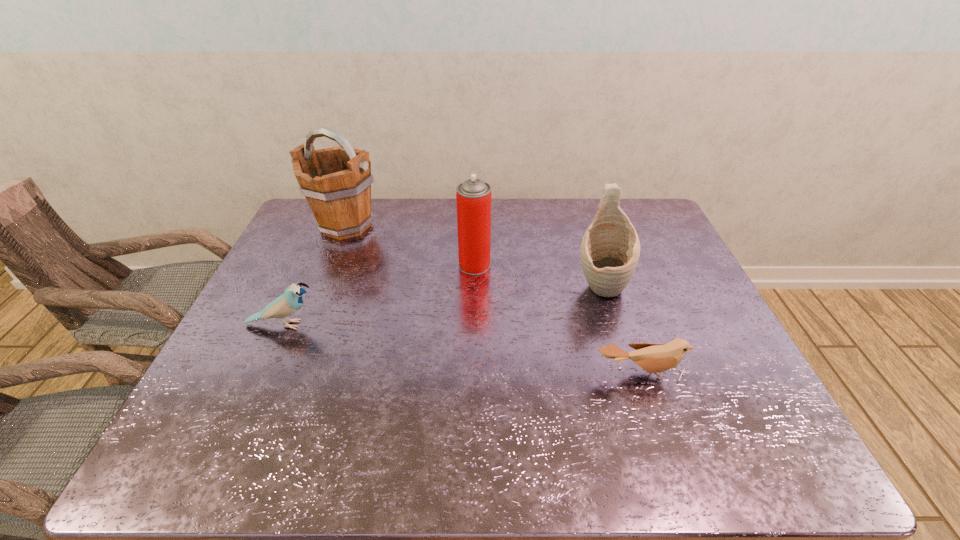
Where is `blank area located at the face of the taller bird`? blank area located at the face of the taller bird is located at coordinates (344, 325).

Where is `free point located at the beak of the nearest object`? free point located at the beak of the nearest object is located at coordinates (666, 451).

The height and width of the screenshot is (540, 960). What are the coordinates of `object located in the far edge section of the desktop` in the screenshot? It's located at (336, 182).

Where is `bucket located at the left edge`? Image resolution: width=960 pixels, height=540 pixels. bucket located at the left edge is located at coordinates (336, 182).

Where is `bird at the left edge`? The image size is (960, 540). bird at the left edge is located at coordinates (291, 301).

You are a GUI agent. You are given a task and a screenshot of the screen. Output one action in this format:
    pyautogui.click(x=<x>, y=<y>)
    Task: Click on the object situated at the right edge
    The height and width of the screenshot is (540, 960).
    Given the screenshot: What is the action you would take?
    pyautogui.click(x=653, y=358)

The image size is (960, 540). I want to click on object positioned at the far left corner, so click(336, 182).

You are a GUI agent. You are given a task and a screenshot of the screen. Output one action in this format:
    pyautogui.click(x=<x>, y=<y>)
    Task: Click on the vacant space at the far edge of the desktop
    The image size is (960, 540).
    Given the screenshot: What is the action you would take?
    pyautogui.click(x=552, y=218)

In the image, there is a desktop. Where is `vacant space at the near edge`? vacant space at the near edge is located at coordinates coord(513,444).

In order to click on free space at the left edge of the desktop in this screenshot , I will do `click(301, 242)`.